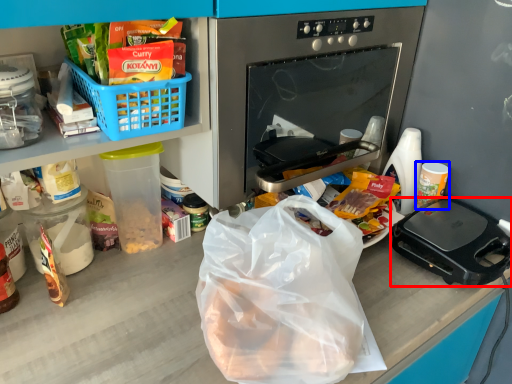
Question: Which object appears farthest to the camera in this image, kitchen appliance (highlighted by a red box) or coffee cup (highlighted by a blue box)?

Choices:
 (A) kitchen appliance
 (B) coffee cup

Answer: (B)